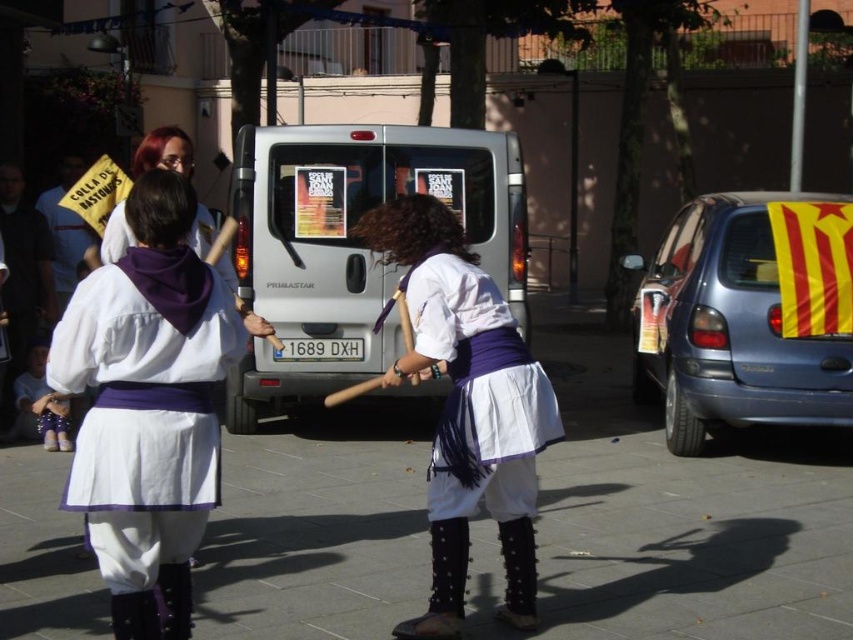
Can you confirm if silver metallic van at center is thinner than white cotton dress at center?

In fact, silver metallic van at center might be wider than white cotton dress at center.

Which is below, silver metallic van at center or white cotton dress at center?

Positioned lower is white cotton dress at center.

Which is in front, point (317, 138) or point (515, 484)?

Point (515, 484)

Find the location of a particular element. silver metallic van at center is located at coordinates (352, 243).

Is silver metallic van at center below white cotton shirt at center?

Yes, silver metallic van at center is below white cotton shirt at center.

Does silver metallic van at center appear on the right side of white cotton shirt at center?

Correct, you'll find silver metallic van at center to the right of white cotton shirt at center.

Does point (346, 356) come behind point (74, 260)?

No, (346, 356) is closer to viewer.

Find the location of a particular element. The height and width of the screenshot is (640, 853). silver metallic van at center is located at coordinates (352, 243).

Can you confirm if matte white blouse at center is wider than white cotton skirt at center?

In fact, matte white blouse at center might be narrower than white cotton skirt at center.

Is point (119, 360) less distant than point (445, 461)?

Yes, point (119, 360) is in front of point (445, 461).

Find the location of a particular element. matte white blouse at center is located at coordinates (149, 404).